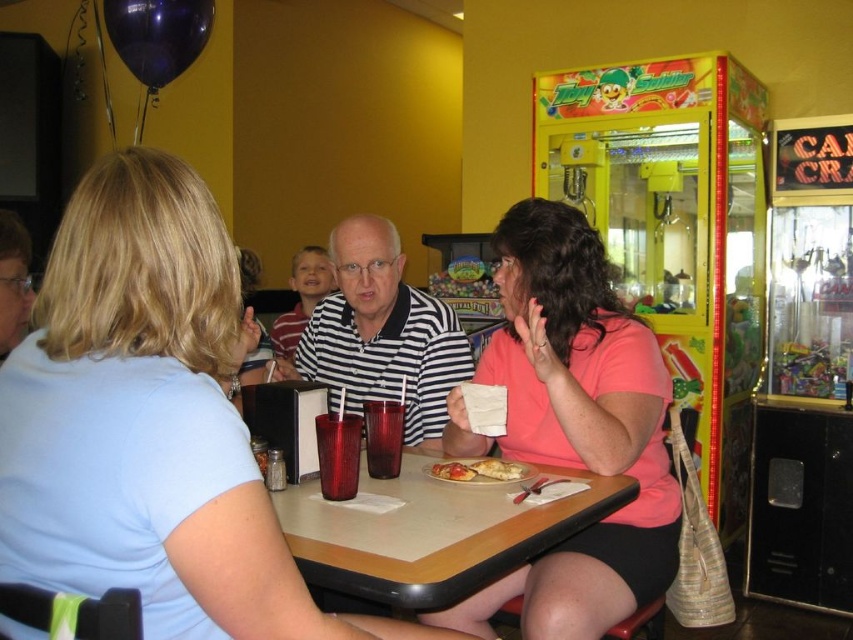
Question: Considering the real-world distances, which object is closest to the light blue shirt at center?

Choices:
 (A) translucent plastic cup at table center
 (B) golden crispy pastry at center
 (C) striped shirt at center

Answer: (A)

Question: Can you confirm if wooden table at center is bigger than striped shirt at center?

Choices:
 (A) yes
 (B) no

Answer: (B)

Question: In this image, where is light blue shirt at center located relative to translucent plastic cup at table center?

Choices:
 (A) below
 (B) above

Answer: (B)

Question: Among these points, which one is nearest to the camera?

Choices:
 (A) (492, 468)
 (B) (544, 452)

Answer: (A)

Question: Which point is farther to the camera?

Choices:
 (A) translucent red glass at table center
 (B) golden crispy pastry at center
 (C) striped shirt at center

Answer: (C)

Question: Does wooden table at center lie behind golden crispy pizza slice at center?

Choices:
 (A) yes
 (B) no

Answer: (B)